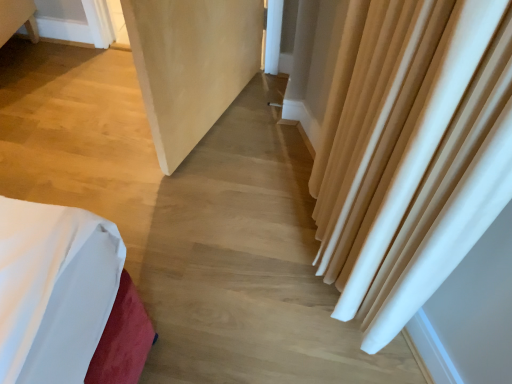
Question: From a real-world perspective, is beige fabric curtain at right under matte white screen door at center?

Choices:
 (A) yes
 (B) no

Answer: (A)

Question: Considering the relative positions of beige fabric curtain at right and matte white screen door at center in the image provided, is beige fabric curtain at right behind matte white screen door at center?

Choices:
 (A) yes
 (B) no

Answer: (A)

Question: Is matte white screen door at center at the back of beige fabric curtain at right?

Choices:
 (A) yes
 (B) no

Answer: (B)

Question: Considering the relative sizes of beige fabric curtain at right and matte white screen door at center in the image provided, is beige fabric curtain at right shorter than matte white screen door at center?

Choices:
 (A) no
 (B) yes

Answer: (B)

Question: Is beige fabric curtain at right smaller than matte white screen door at center?

Choices:
 (A) yes
 (B) no

Answer: (A)

Question: From the image's perspective, is beige fabric curtain at right located above matte white screen door at center?

Choices:
 (A) yes
 (B) no

Answer: (B)

Question: Is matte white screen door at center at the left side of beige fabric curtain at right?

Choices:
 (A) no
 (B) yes

Answer: (B)

Question: Does matte white screen door at center have a greater height compared to beige fabric curtain at right?

Choices:
 (A) yes
 (B) no

Answer: (A)

Question: Does matte white screen door at center have a smaller size compared to beige fabric curtain at right?

Choices:
 (A) no
 (B) yes

Answer: (A)

Question: Does matte white screen door at center have a lesser height compared to beige fabric curtain at right?

Choices:
 (A) no
 (B) yes

Answer: (A)

Question: Considering the relative positions of matte white screen door at center and beige fabric curtain at right in the image provided, is matte white screen door at center to the right of beige fabric curtain at right from the viewer's perspective?

Choices:
 (A) no
 (B) yes

Answer: (A)

Question: Is matte white screen door at center thinner than beige fabric curtain at right?

Choices:
 (A) no
 (B) yes

Answer: (A)

Question: Would you say beige fabric curtain at right is inside or outside matte white screen door at center?

Choices:
 (A) inside
 (B) outside

Answer: (B)